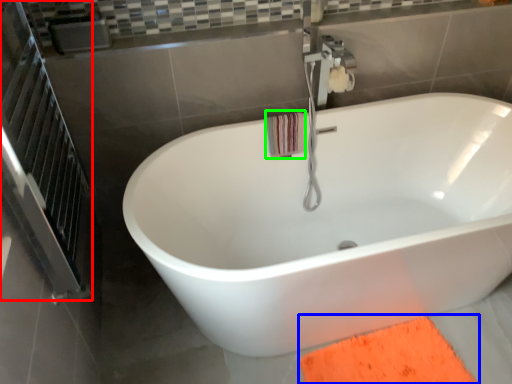
Question: Considering the real-world distances, which object is closest to screen door (highlighted by a red box)? doormat (highlighted by a blue box) or beach towel (highlighted by a green box).

Choices:
 (A) doormat
 (B) beach towel

Answer: (B)